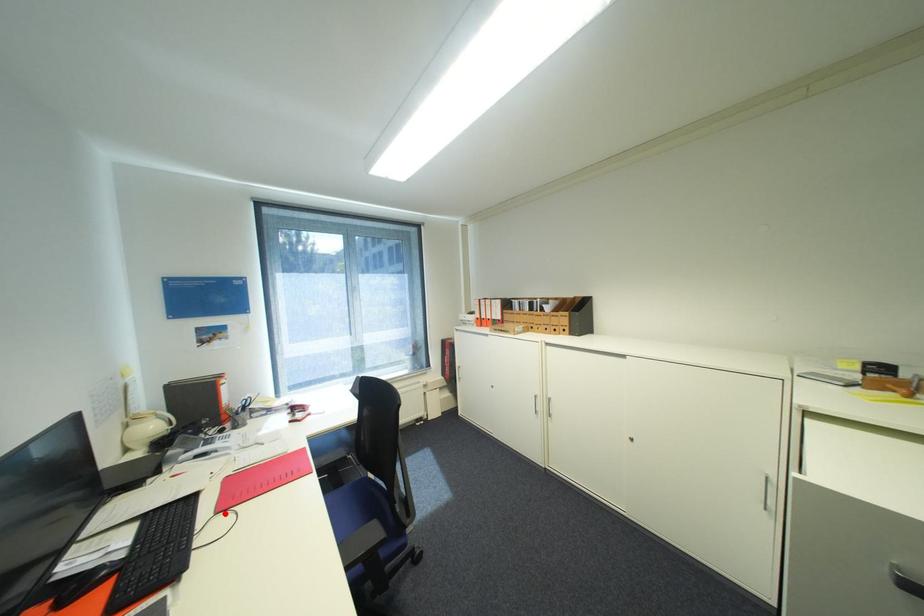
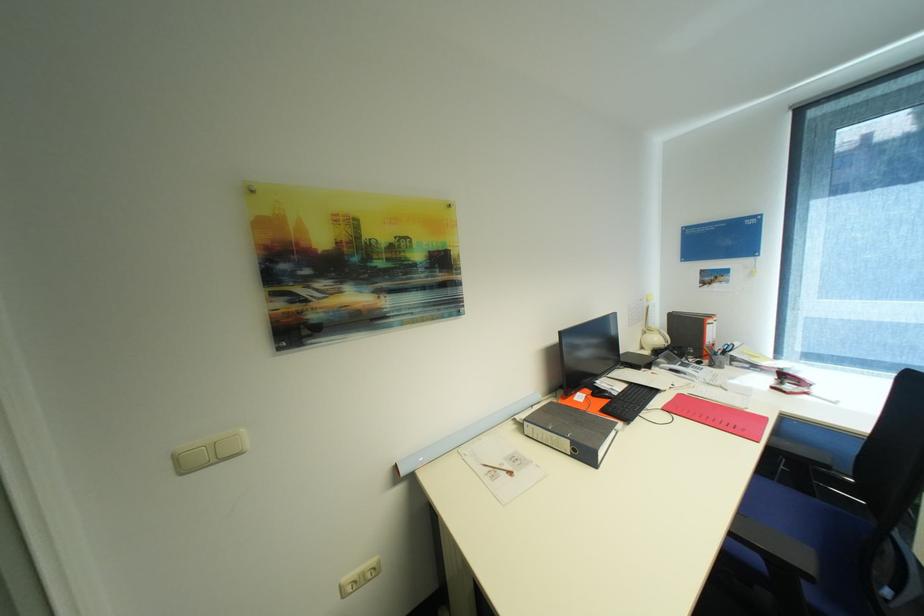
In the second image, find the point that corresponds to the highlighted location in the first image.

(671, 410)